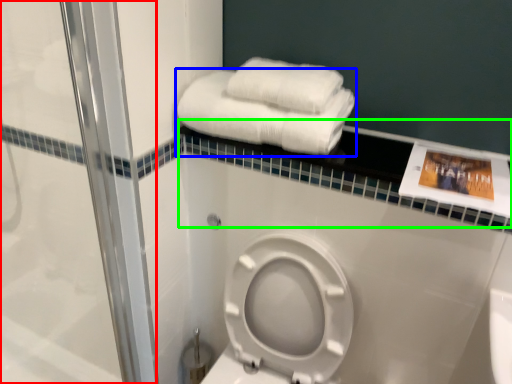
Question: Considering the real-world distances, which object is farthest from shower door (highlighted by a red box)? towel (highlighted by a blue box) or balustrade (highlighted by a green box)?

Choices:
 (A) towel
 (B) balustrade

Answer: (B)